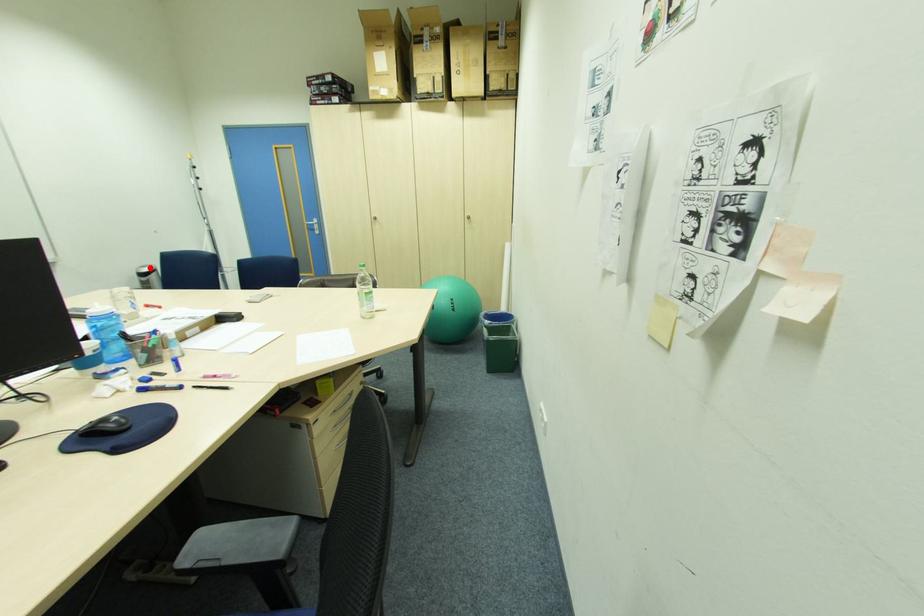
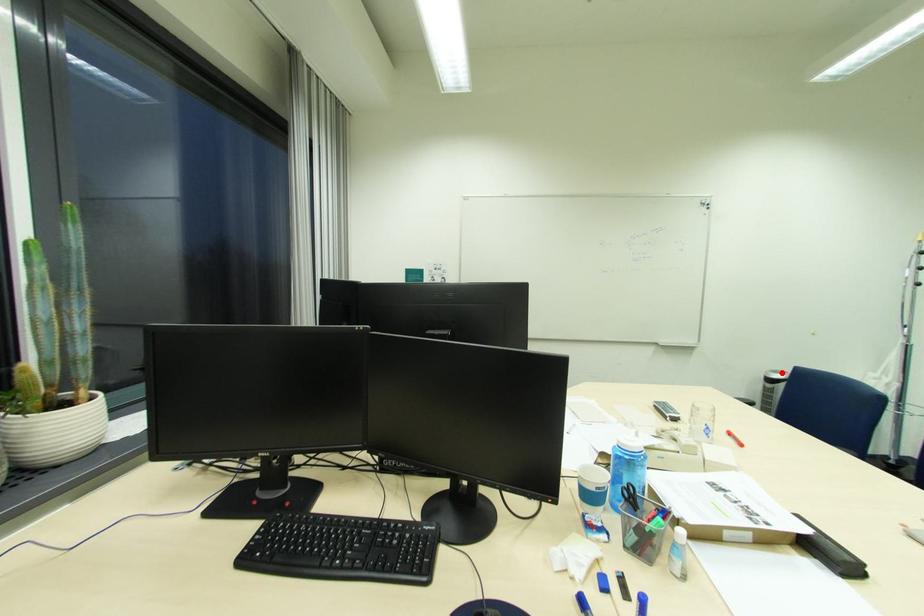
I am providing you with two images of the same scene from different viewpoints. A red point is marked on the first image and another point is marked on the second image. Does the point marked in image1 correspond to the same location as the one in image2?

Yes